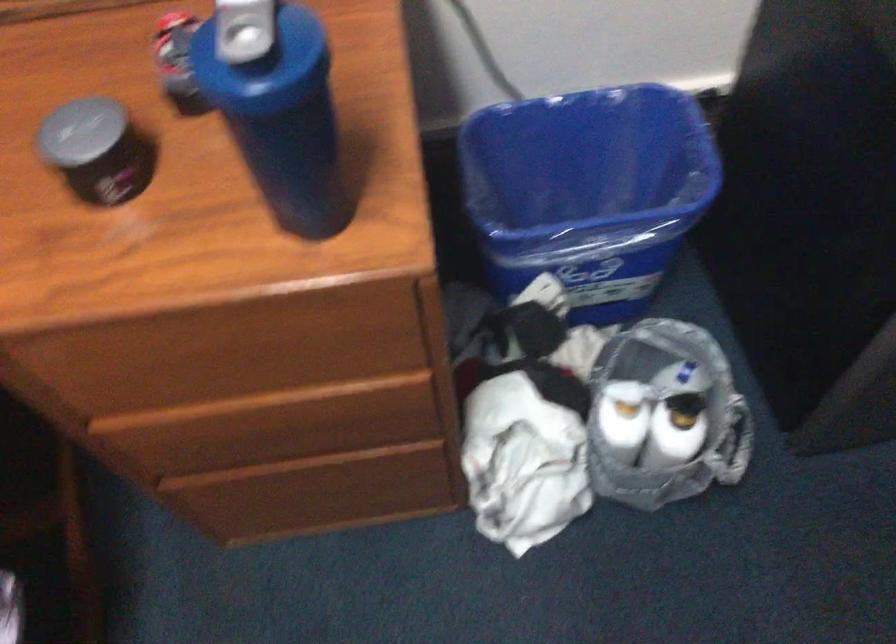
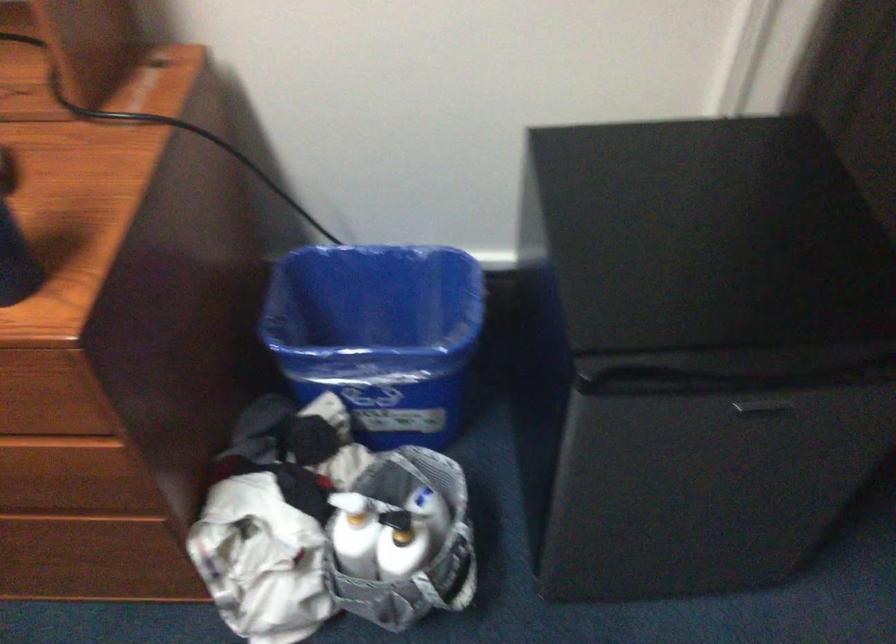
Locate, in the second image, the point that corresponds to (685,426) in the first image.

(401, 544)